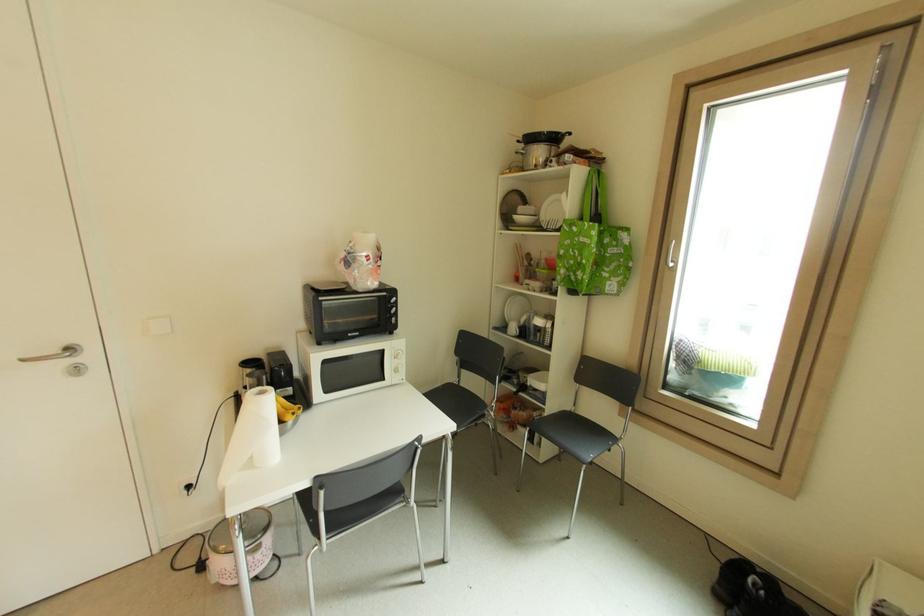
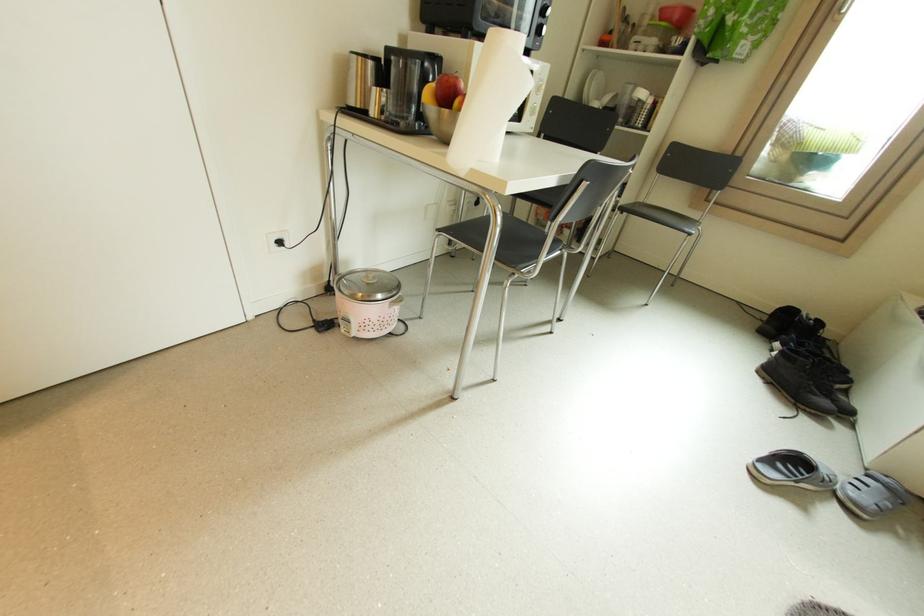
Question: In a continuous first-person perspective shot, in which direction is the camera moving?

Choices:
 (A) Left
 (B) Right
 (C) Forward
 (D) Backward

Answer: (A)